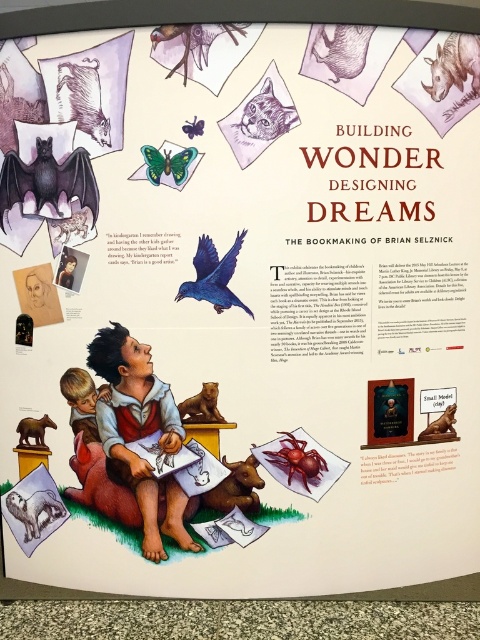
Does shiny gold statue at center come behind matte green butterfly at upper center?

Yes, it is.

Does shiny gold statue at center have a larger size compared to matte green butterfly at upper center?

Yes, shiny gold statue at center is bigger than matte green butterfly at upper center.

Who is more forward, [418,436] or [187,131]?

Point [187,131] is more forward.

Find the location of `shiny gold statue at center`. shiny gold statue at center is located at coordinates (441, 426).

In order to click on gray matte rhinoceros at upper right in this screenshot , I will do `click(454, 65)`.

Who is more forward, (466, 48) or (257, 106)?

Point (257, 106) is in front.

This screenshot has height=640, width=480. I want to click on gray matte rhinoceros at upper right, so click(454, 65).

Does brown furry dog at lower center appear over matte gray cat at upper center?

Actually, brown furry dog at lower center is below matte gray cat at upper center.

Describe the element at coordinates (236, 486) in the screenshot. I see `brown furry dog at lower center` at that location.

Identify the location of brown furry dog at lower center. This screenshot has width=480, height=640. (236, 486).